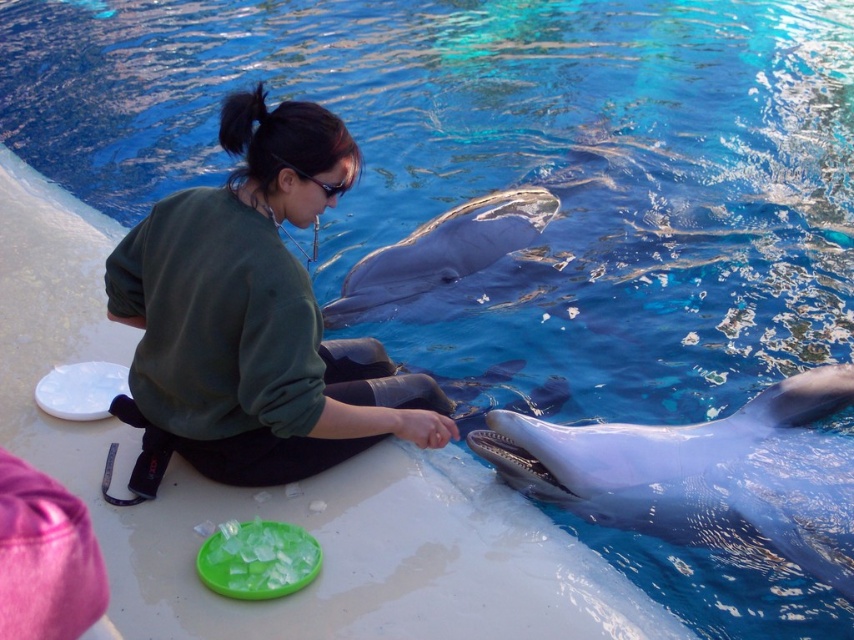
Question: Can you confirm if green matte sweatshirt at center is positioned to the left of smooth gray dolphin at lower right?

Choices:
 (A) no
 (B) yes

Answer: (B)

Question: Is smooth gray dolphin at lower right bigger than sleek gray dolphin at center?

Choices:
 (A) no
 (B) yes

Answer: (A)

Question: Can you confirm if smooth gray dolphin at lower right is positioned to the left of sleek gray dolphin at center?

Choices:
 (A) yes
 (B) no

Answer: (B)

Question: Estimate the real-world distances between objects in this image. Which object is closer to the smooth gray dolphin at lower right?

Choices:
 (A) green matte sweatshirt at center
 (B) sleek gray dolphin at center

Answer: (A)

Question: Based on their relative distances, which object is nearer to the green matte sweatshirt at center?

Choices:
 (A) sleek gray dolphin at center
 (B) smooth gray dolphin at lower right

Answer: (B)

Question: Which object is positioned closest to the green matte sweatshirt at center?

Choices:
 (A) smooth gray dolphin at lower right
 (B) sleek gray dolphin at center

Answer: (A)